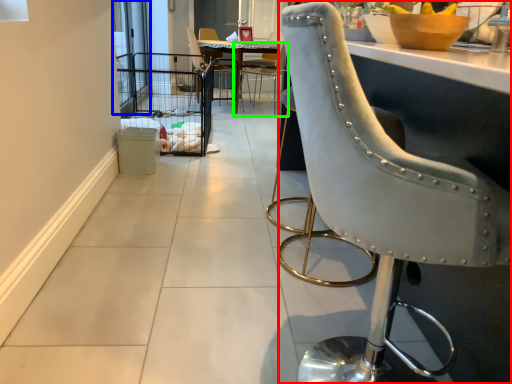
Question: Considering the real-world distances, which object is closest to chair (highlighted by a red box)? screen door (highlighted by a blue box) or chair (highlighted by a green box).

Choices:
 (A) screen door
 (B) chair

Answer: (A)